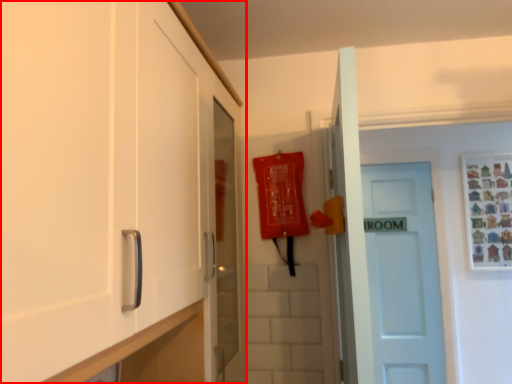
Question: From the image's perspective, what is the correct spatial relationship of cabinetry (annotated by the red box) in relation to door?

Choices:
 (A) above
 (B) below

Answer: (A)